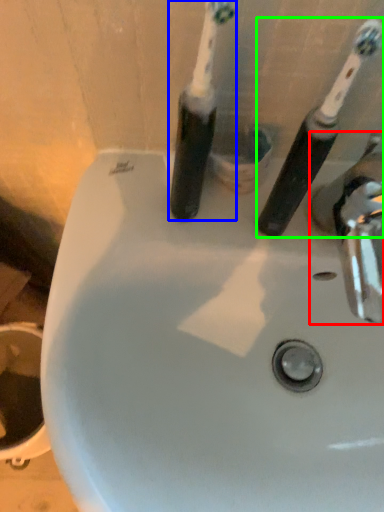
Question: Estimate the real-world distances between objects in this image. Which object is closer to tap (highlighted by a red box), toothbrush (highlighted by a blue box) or toothbrush (highlighted by a green box)?

Choices:
 (A) toothbrush
 (B) toothbrush

Answer: (B)